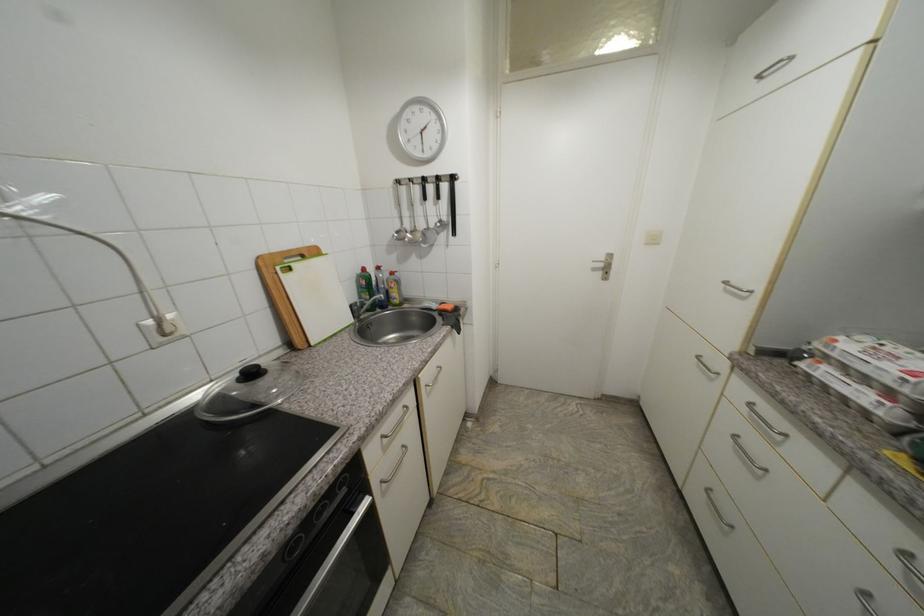
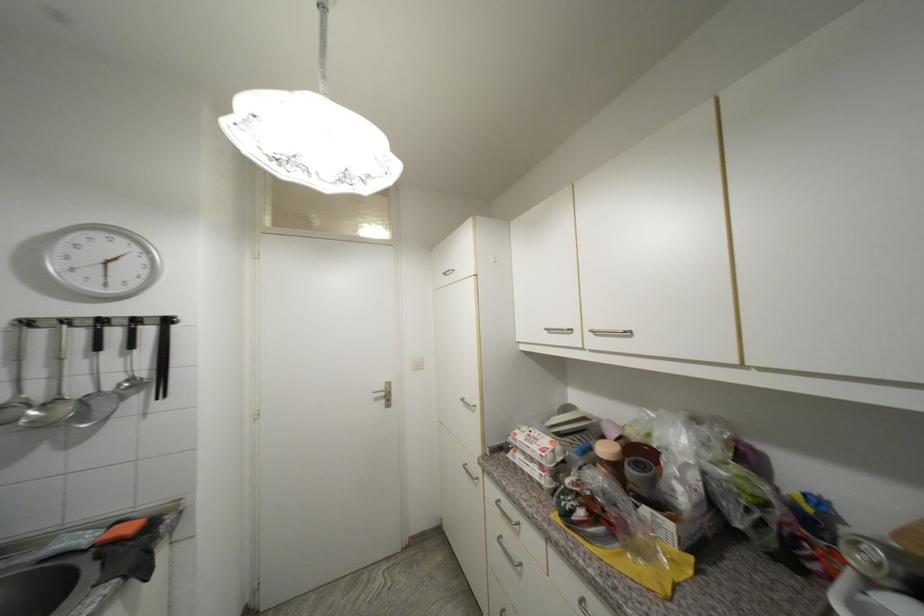
Where in the second image is the point corresponding to [609,261] from the first image?

(388, 390)